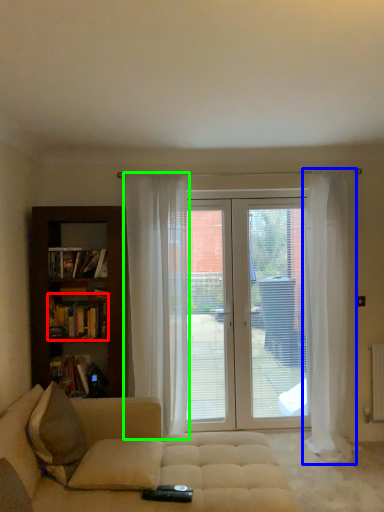
Question: Considering the real-world distances, which object is closest to book (highlighted by a red box)? curtain (highlighted by a blue box) or curtain (highlighted by a green box).

Choices:
 (A) curtain
 (B) curtain

Answer: (B)